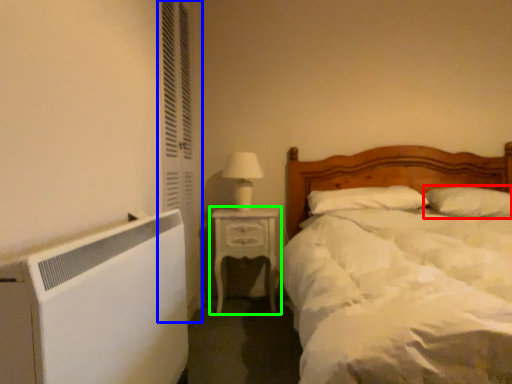
Question: Estimate the real-world distances between objects in this image. Which object is farther from pillow (highlighted by a red box), screen door (highlighted by a blue box) or nightstand (highlighted by a green box)?

Choices:
 (A) screen door
 (B) nightstand

Answer: (A)